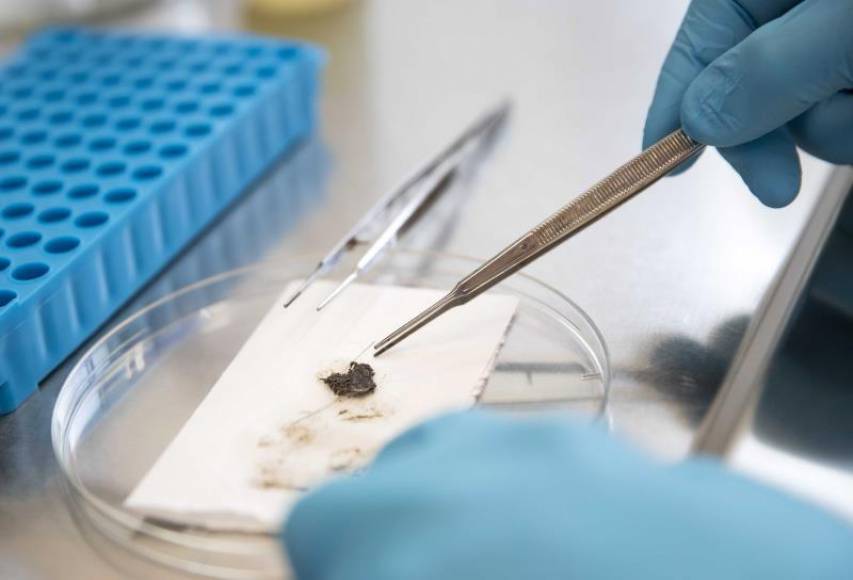
At what (x,y) coordinates should I click in order to perform the action: click on counter. Please return your answer as a coordinate pair (x, y). The height and width of the screenshot is (580, 853). Looking at the image, I should click on (595, 45).